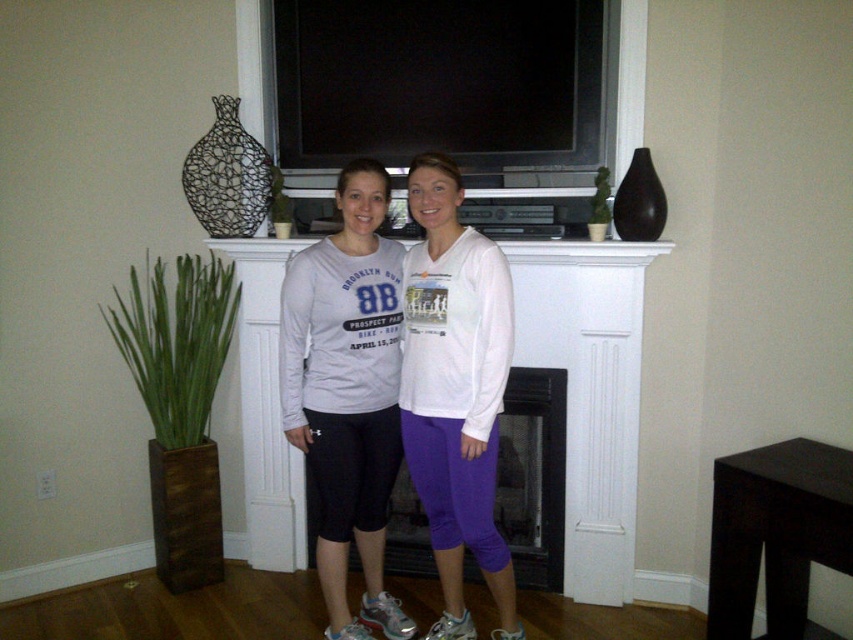
Can you confirm if matte gray sweatshirt at center is bigger than purple cotton leggings at center?

Yes.

Between point (322, 444) and point (451, 627), which one is positioned in front?

Point (322, 444) is in front.

At what (x,y) coordinates should I click in order to perform the action: click on matte gray sweatshirt at center. Please return your answer as a coordinate pair (x, y). Looking at the image, I should click on (347, 394).

Is purple cotton leggings at center to the right of black glass fireplace at center from the viewer's perspective?

In fact, purple cotton leggings at center is to the left of black glass fireplace at center.

Does purple cotton leggings at center appear under black glass fireplace at center?

Incorrect, purple cotton leggings at center is not positioned below black glass fireplace at center.

Does point (413, 424) lie in front of point (532, 509)?

Yes, it is.

This screenshot has width=853, height=640. I want to click on purple cotton leggings at center, so click(x=456, y=392).

Can you confirm if matte gray sweatshirt at center is wider than black glass fireplace at center?

In fact, matte gray sweatshirt at center might be narrower than black glass fireplace at center.

What are the coordinates of `matte gray sweatshirt at center` in the screenshot? It's located at coord(347,394).

Where is `matte gray sweatshirt at center`? The image size is (853, 640). matte gray sweatshirt at center is located at coordinates (347, 394).